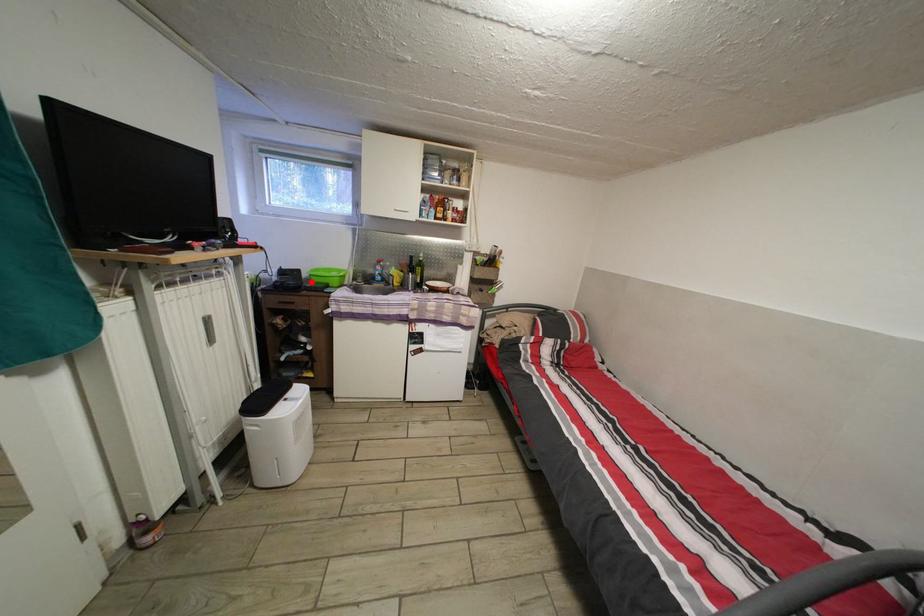
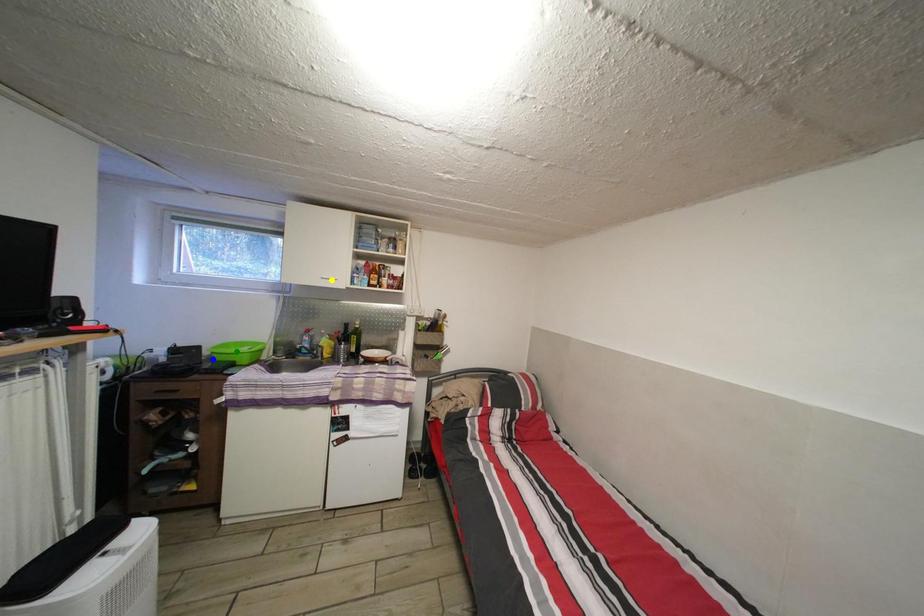
Question: I am providing you with two images of the same scene from different viewpoints. A red point is marked on the first image. You are given multiple points on the second image. Can you choose the point in image 2 that corresponds to the point in image 1?

Choices:
 (A) blue point
 (B) yellow point
 (C) green point

Answer: (A)